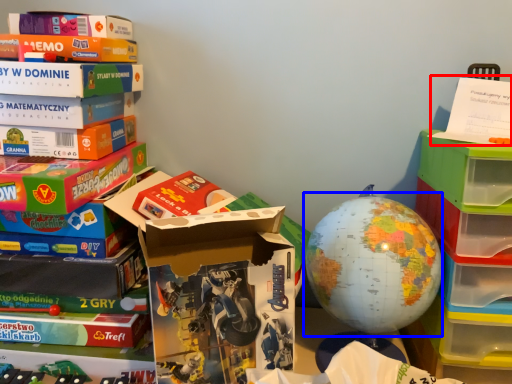
Question: Which point is closer to the camera, paperback book (highlighted by a red box) or earth (highlighted by a blue box)?

Choices:
 (A) paperback book
 (B) earth

Answer: (A)